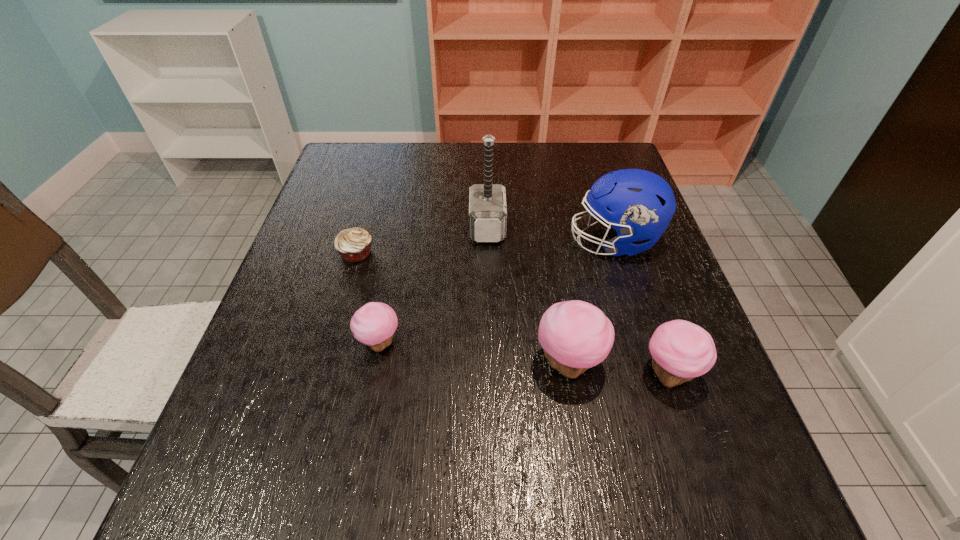
I want to click on unoccupied area between the fifth shortest object and the third object from left to right, so click(x=550, y=234).

This screenshot has width=960, height=540. In order to click on vacant point located between the shortest cupcake and the shortest object in this screenshot , I will do `click(368, 298)`.

Where is `free space between the football helmet and the shortest object`? The image size is (960, 540). free space between the football helmet and the shortest object is located at coordinates (485, 247).

Find the location of `vacant area between the leftmost object and the third object from left to right`. vacant area between the leftmost object and the third object from left to right is located at coordinates (421, 240).

Identify the location of vacant space in between the second tallest cupcake and the football helmet. The height and width of the screenshot is (540, 960). (641, 307).

In order to click on unoccupied area between the tallest cupcake and the football helmet in this screenshot , I will do `click(591, 302)`.

You are a GUI agent. You are given a task and a screenshot of the screen. Output one action in this format:
    pyautogui.click(x=<x>, y=<y>)
    Task: Click on the blank region between the second cupcake from right to left and the fifth shortest object
    The height and width of the screenshot is (540, 960).
    Given the screenshot: What is the action you would take?
    pyautogui.click(x=591, y=302)

Locate an element on the screen. Image resolution: width=960 pixels, height=540 pixels. free area in between the shortest cupcake and the tallest cupcake is located at coordinates (474, 353).

Identify which object is located as the second nearest to the tallest cupcake. Please provide its 2D coordinates. Your answer should be formatted as a tuple, i.e. [(x, y)], where the tuple contains the x and y coordinates of a point satisfying the conditions above.

[(639, 204)]

Find the location of a particular element. object that is the second nearest to the shortest cupcake is located at coordinates (575, 335).